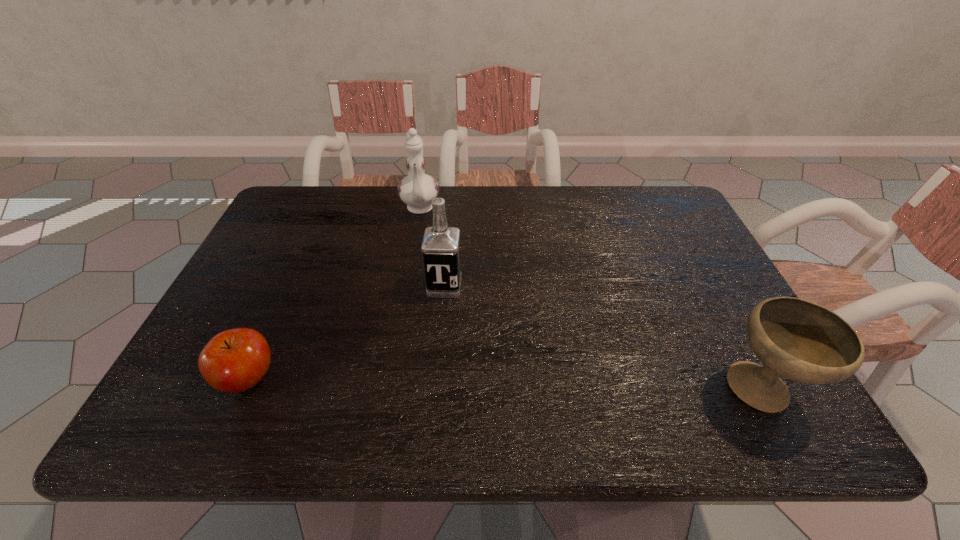
Find the location of `free space on the desktop that is between the shortest object and the chalice and is positioned at the spout of the farthest object`. free space on the desktop that is between the shortest object and the chalice and is positioned at the spout of the farthest object is located at coordinates [x=426, y=383].

Locate an element on the screen. This screenshot has height=540, width=960. free space on the desktop that is between the shortest object and the second shortest object and is positioned on the front label of the second farthest object is located at coordinates (431, 383).